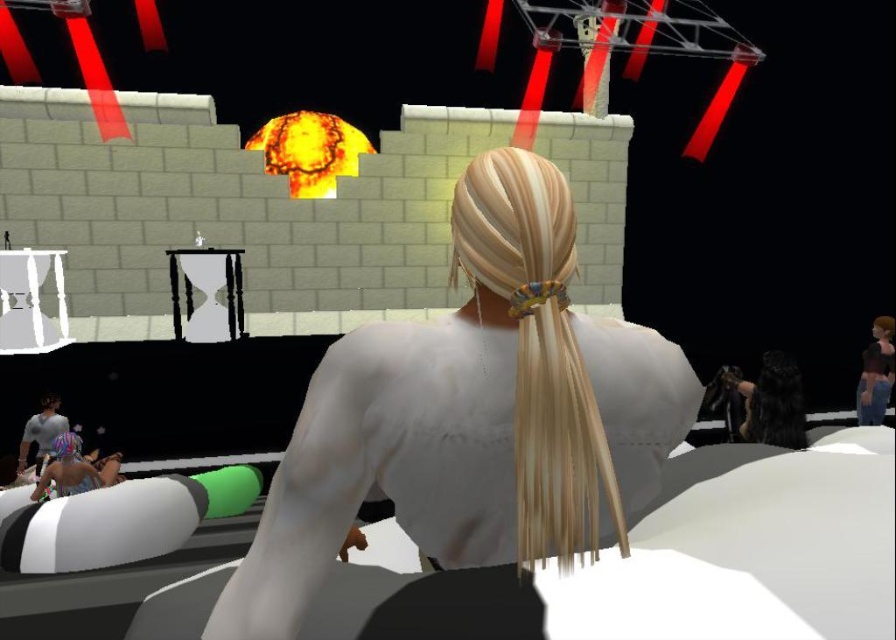
You are controlling the character in this virtual environment and want to move towards the point that is closer to you. Which point should you move toward, point (557, 403) or point (803, 445)?

Answer: You should move toward point (557, 403) because it is in front of point (803, 445), making it closer to your current position.

You are a character in the game and want to check your reflection in the water nearby. Which hair color will be more visible in the reflection? The white matte hair at center or the shiny black hair at center?

The shiny black hair at center will be more visible in the reflection because it reflects light better than the white matte hair at center.